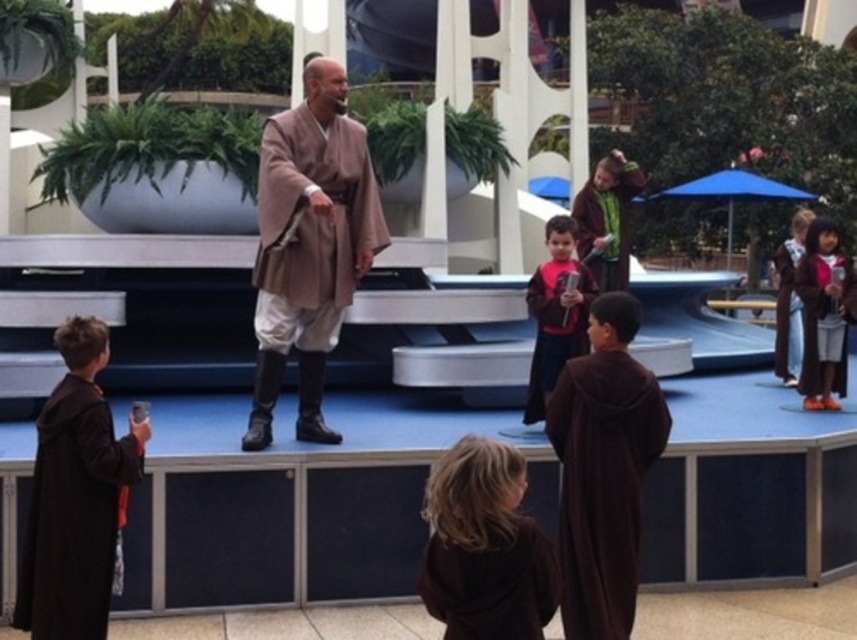
Question: Is brown velvety robe at center thinner than brown woolen robe at right?

Choices:
 (A) no
 (B) yes

Answer: (B)

Question: Which point is farther to the camera?

Choices:
 (A) (271, 304)
 (B) (528, 388)
 (C) (792, 273)
 (D) (604, 204)

Answer: (C)

Question: Which point is farther from the camera taking this photo?

Choices:
 (A) (418, 588)
 (B) (792, 342)
 (C) (549, 278)

Answer: (B)

Question: Is matte brown robe at center thinner than pink fabric shirt at center?

Choices:
 (A) yes
 (B) no

Answer: (B)

Question: Which object is the farthest from the brown fuzzy robe at center?

Choices:
 (A) black matte robe at lower left
 (B) matte brown robe at center

Answer: (A)

Question: Does brown woolen robe at lower center appear under pink fabric shirt at center?

Choices:
 (A) yes
 (B) no

Answer: (A)